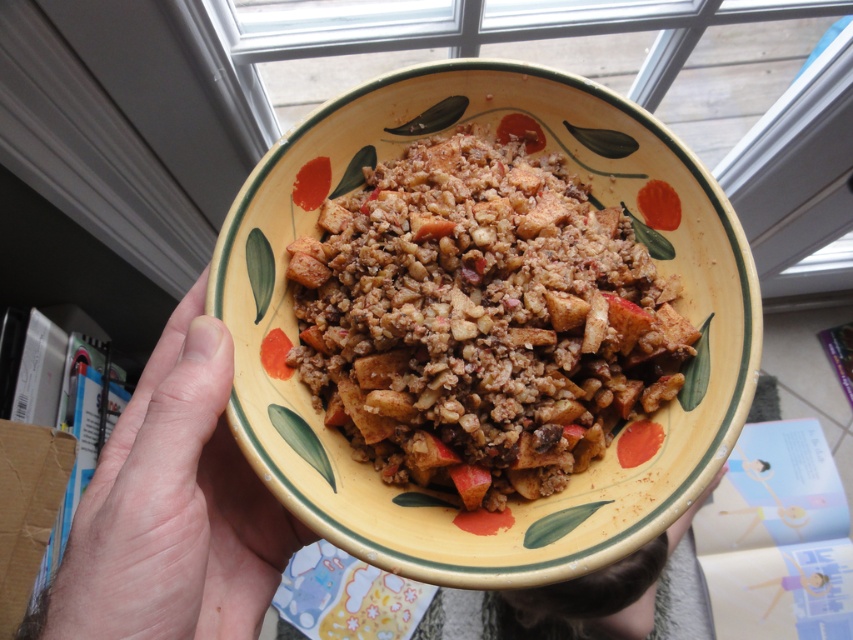
You are a chef preparing a dish and need to know which portion is larger between the matte brown crumble at center and the pale skin at lower left. Can you determine which one is larger?

The matte brown crumble at center is bigger than the pale skin at lower left, so the matte brown crumble at center is the larger portion.

You are a chef preparing a meal and see the image. You need to place a garnish on the pale skin at lower left. Where should you place it relative to the matte brown crumble at center?

The pale skin at lower left is to the left of the matte brown crumble at center, so you should place the garnish to the left of the matte brown crumble at center.

You are a chef preparing a dish and need to place a pale skin at lower left next to the yellow matte bowl at center on a counter. Considering their sizes, which object will require more counter space?

The yellow matte bowl at center requires more counter space because the pale skin at lower left is narrower than the yellow matte bowl at center.